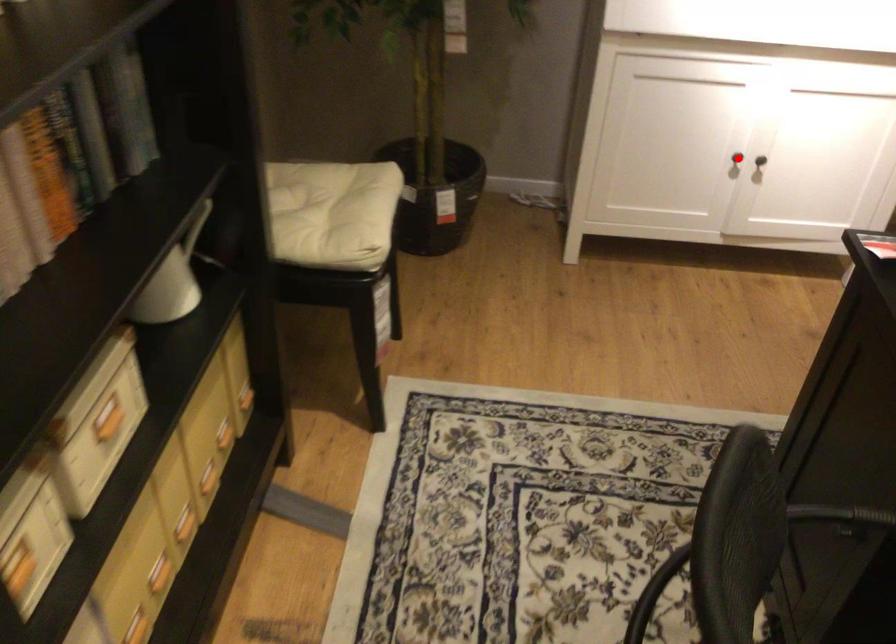
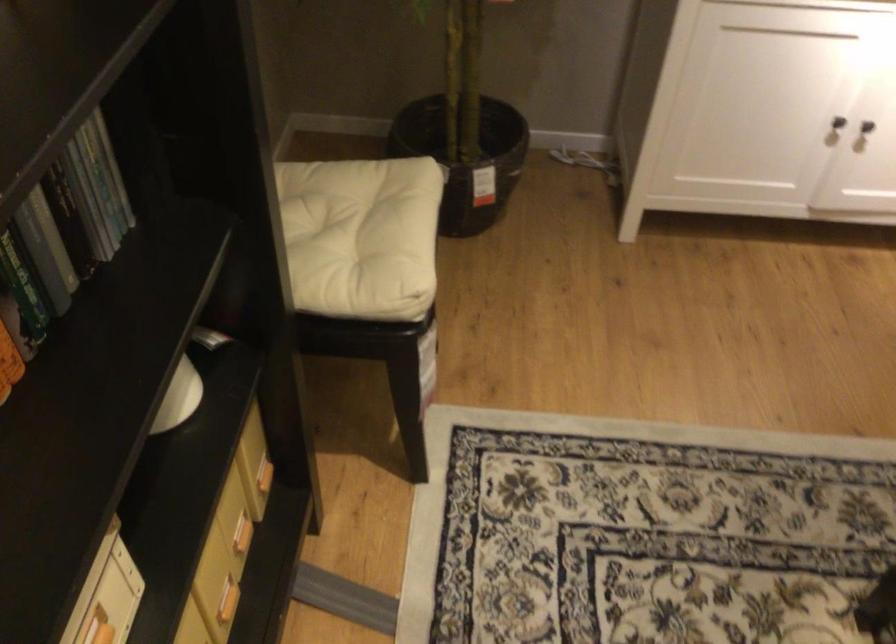
Find the pixel in the second image that matches the highlighted location in the first image.

(838, 122)